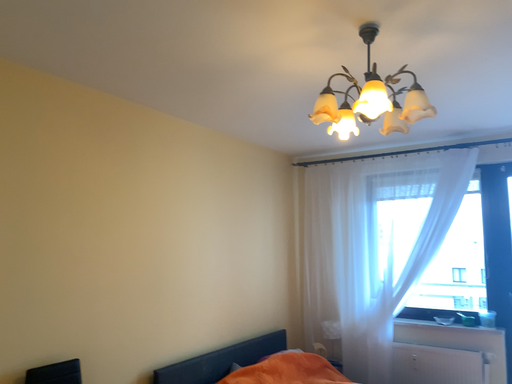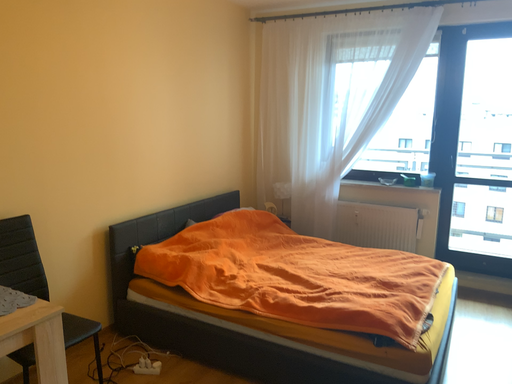
Question: Which way did the camera rotate in the video?

Choices:
 (A) rotated upward
 (B) rotated downward

Answer: (B)